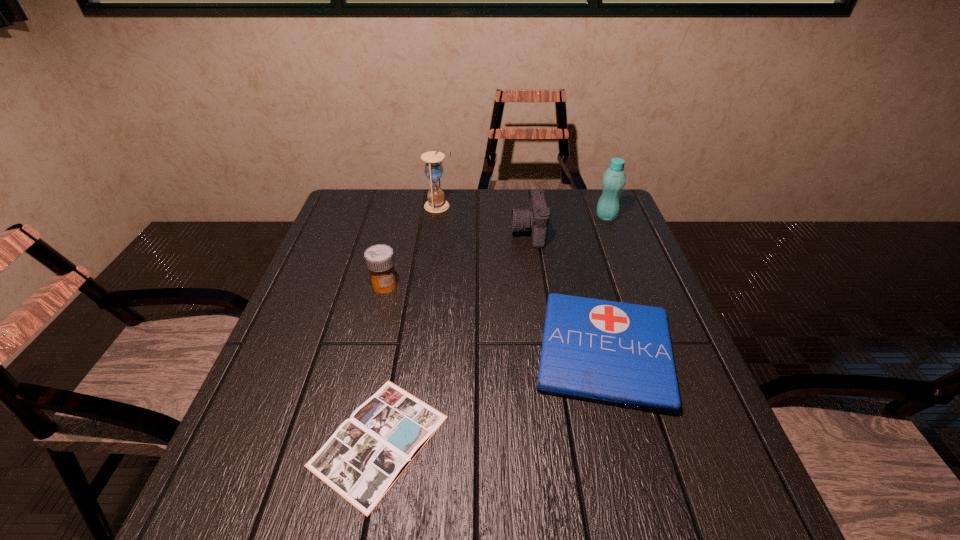
The image size is (960, 540). I want to click on the first-aid kit that is at the right edge, so click(x=616, y=353).

Identify the location of object that is at the near left corner. This screenshot has height=540, width=960. (364, 457).

In order to click on object at the far right corner in this screenshot , I will do `click(614, 178)`.

Identify the location of vacant area at the far edge. This screenshot has height=540, width=960. (451, 199).

Locate an element on the screen. The image size is (960, 540). free region at the near edge of the desktop is located at coordinates (540, 507).

Image resolution: width=960 pixels, height=540 pixels. In the image, there is a desktop. Identify the location of vacant space at the left edge. (314, 427).

You are a GUI agent. You are given a task and a screenshot of the screen. Output one action in this format:
    pyautogui.click(x=<x>, y=<y>)
    Task: Click on the vacant space at the right edge
    
    Given the screenshot: What is the action you would take?
    pyautogui.click(x=634, y=252)

This screenshot has width=960, height=540. I want to click on vacant area at the near left corner, so click(212, 516).

Identify the location of free space at the far right corner. This screenshot has width=960, height=540. (586, 197).

In order to click on free space at the near right corner in this screenshot , I will do `click(737, 507)`.